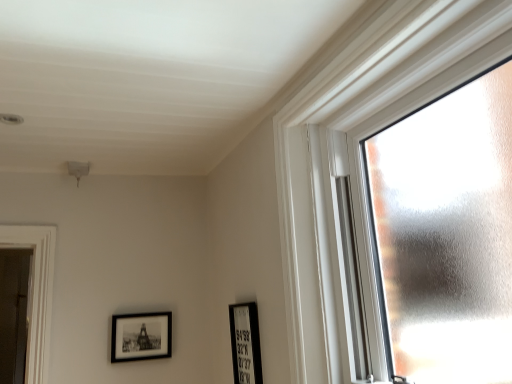
The width and height of the screenshot is (512, 384). In order to click on black matte picture frame at lower center, the second picture frame when ordered from back to front in this screenshot , I will do `click(245, 343)`.

Where is `frosted glass window at right`? frosted glass window at right is located at coordinates (368, 134).

Where is `black matte picture frame at lower center, the 1th picture frame in the right-to-left sequence`? black matte picture frame at lower center, the 1th picture frame in the right-to-left sequence is located at coordinates (245, 343).

Find the location of `window to the right of black matte picture frame at lower left, which ranks as the 2th picture frame in right-to-left order`. window to the right of black matte picture frame at lower left, which ranks as the 2th picture frame in right-to-left order is located at coordinates (368, 134).

What's the angular difference between frosted glass window at right and black matte picture frame at lower left, which appears as the 2th picture frame when viewed from the front,'s facing directions?

The facing directions of frosted glass window at right and black matte picture frame at lower left, which appears as the 2th picture frame when viewed from the front, are 88.3 degrees apart.

Is frosted glass window at right at the left side of black matte picture frame at lower left, acting as the 1th picture frame starting from the back?

No, frosted glass window at right is not to the left of black matte picture frame at lower left, acting as the 1th picture frame starting from the back.

Does point (240, 379) lie behind point (146, 324)?

No, it is in front of (146, 324).

Identify the location of picture frame below the black matte picture frame at lower center, which ranks as the second picture frame in left-to-right order (from the image's perspective). This screenshot has height=384, width=512. (141, 336).

Is black matte picture frame at lower center, placed as the 1th picture frame when sorted from front to back, positioned beyond the bounds of black matte picture frame at lower left, acting as the 1th picture frame starting from the back?

Absolutely, black matte picture frame at lower center, placed as the 1th picture frame when sorted from front to back, is external to black matte picture frame at lower left, acting as the 1th picture frame starting from the back.

Between black matte picture frame at lower center, the 1th picture frame in the right-to-left sequence, and black matte picture frame at lower left, which ranks as the 2th picture frame in right-to-left order, which one has larger width?

With larger width is black matte picture frame at lower center, the 1th picture frame in the right-to-left sequence.

Is black matte picture frame at lower left, which ranks as the 2th picture frame in right-to-left order, situated inside black matte picture frame at lower center, placed as the 1th picture frame when sorted from front to back, or outside?

black matte picture frame at lower left, which ranks as the 2th picture frame in right-to-left order, exists outside the volume of black matte picture frame at lower center, placed as the 1th picture frame when sorted from front to back.

Is black matte picture frame at lower left, marked as the 1th picture frame in a left-to-right arrangement, in contact with black matte picture frame at lower center, placed as the 1th picture frame when sorted from front to back?

black matte picture frame at lower left, marked as the 1th picture frame in a left-to-right arrangement, and black matte picture frame at lower center, placed as the 1th picture frame when sorted from front to back, are clearly separated.

From the image's perspective, is black matte picture frame at lower left, marked as the 1th picture frame in a left-to-right arrangement, located beneath black matte picture frame at lower center, the second picture frame when ordered from back to front?

Yes, from the image's perspective, black matte picture frame at lower left, marked as the 1th picture frame in a left-to-right arrangement, is beneath black matte picture frame at lower center, the second picture frame when ordered from back to front.

From a real-world perspective, is black matte picture frame at lower left, which ranks as the 2th picture frame in right-to-left order, below black matte picture frame at lower center, placed as the 1th picture frame when sorted from front to back?

No, from a real-world perspective, black matte picture frame at lower left, which ranks as the 2th picture frame in right-to-left order, is not below black matte picture frame at lower center, placed as the 1th picture frame when sorted from front to back.

Which is in front, point (357, 224) or point (244, 371)?

Point (357, 224)

Is there a large distance between frosted glass window at right and black matte picture frame at lower center, the 1th picture frame in the right-to-left sequence?

frosted glass window at right is actually quite close to black matte picture frame at lower center, the 1th picture frame in the right-to-left sequence.

Would you say frosted glass window at right is outside black matte picture frame at lower center, placed as the 1th picture frame when sorted from front to back?

frosted glass window at right is positioned outside black matte picture frame at lower center, placed as the 1th picture frame when sorted from front to back.

Locate an element on the screen. The image size is (512, 384). the 1st picture frame to the left when counting from the frosted glass window at right is located at coordinates (245, 343).

Who is more distant, black matte picture frame at lower left, acting as the 1th picture frame starting from the back, or frosted glass window at right?

black matte picture frame at lower left, acting as the 1th picture frame starting from the back, is more distant.

How many degrees apart are the facing directions of black matte picture frame at lower left, acting as the 1th picture frame starting from the back, and frosted glass window at right?

The angle between the facing direction of black matte picture frame at lower left, acting as the 1th picture frame starting from the back, and the facing direction of frosted glass window at right is 88.3 degrees.

From a real-world perspective, which object rests below the other?

black matte picture frame at lower left, which appears as the 2th picture frame when viewed from the front, from a real-world perspective.

Considering the points (160, 326) and (419, 92), which point is behind, point (160, 326) or point (419, 92)?

Point (160, 326)

From a real-world perspective, is black matte picture frame at lower center, the 1th picture frame in the right-to-left sequence, above or below frosted glass window at right?

black matte picture frame at lower center, the 1th picture frame in the right-to-left sequence, is situated lower than frosted glass window at right in the real world.

You are a GUI agent. You are given a task and a screenshot of the screen. Output one action in this format:
    pyautogui.click(x=<x>, y=<y>)
    Task: Click on the window that is above the black matte picture frame at lower center, which ranks as the second picture frame in left-to-right order (from a real-world perspective)
    
    Given the screenshot: What is the action you would take?
    pyautogui.click(x=368, y=134)

Is black matte picture frame at lower center, the 1th picture frame in the right-to-left sequence, not near frosted glass window at right?

No, black matte picture frame at lower center, the 1th picture frame in the right-to-left sequence, is not far from frosted glass window at right.

From their relative heights in the image, would you say black matte picture frame at lower center, the 1th picture frame in the right-to-left sequence, is taller or shorter than frosted glass window at right?

In the image, black matte picture frame at lower center, the 1th picture frame in the right-to-left sequence, appears to be shorter than frosted glass window at right.

Locate an element on the screen. picture frame that is the 2nd object to the left of the frosted glass window at right, starting at the anchor is located at coordinates (141, 336).

This screenshot has height=384, width=512. Find the location of `picture frame above the black matte picture frame at lower left, which appears as the 2th picture frame when viewed from the front (from the image's perspective)`. picture frame above the black matte picture frame at lower left, which appears as the 2th picture frame when viewed from the front (from the image's perspective) is located at coordinates (245, 343).

When comparing their distances from black matte picture frame at lower center, the second picture frame when ordered from back to front, does frosted glass window at right or black matte picture frame at lower left, acting as the 1th picture frame starting from the back, seem further?

frosted glass window at right is further to black matte picture frame at lower center, the second picture frame when ordered from back to front.

Looking at the image, which one is located closer to black matte picture frame at lower center, which ranks as the second picture frame in left-to-right order, black matte picture frame at lower left, which ranks as the 2th picture frame in right-to-left order, or frosted glass window at right?

A: black matte picture frame at lower left, which ranks as the 2th picture frame in right-to-left order, lies closer to black matte picture frame at lower center, which ranks as the second picture frame in left-to-right order, than the other object.

Considering their positions, is black matte picture frame at lower center, which ranks as the second picture frame in left-to-right order, positioned further to frosted glass window at right than black matte picture frame at lower left, which ranks as the 2th picture frame in right-to-left order?

black matte picture frame at lower left, which ranks as the 2th picture frame in right-to-left order, is further to frosted glass window at right.

Consider the image. Estimate the real-world distances between objects in this image. Which object is further from black matte picture frame at lower left, which appears as the 2th picture frame when viewed from the front, frosted glass window at right or black matte picture frame at lower center, the second picture frame when ordered from back to front?

frosted glass window at right.

Which object lies further to the anchor point frosted glass window at right, black matte picture frame at lower left, marked as the 1th picture frame in a left-to-right arrangement, or black matte picture frame at lower center, the 1th picture frame in the right-to-left sequence?

The object further to frosted glass window at right is black matte picture frame at lower left, marked as the 1th picture frame in a left-to-right arrangement.

Which object lies further to the anchor point black matte picture frame at lower left, marked as the 1th picture frame in a left-to-right arrangement, black matte picture frame at lower center, the second picture frame when ordered from back to front, or frosted glass window at right?

frosted glass window at right is positioned further to the anchor black matte picture frame at lower left, marked as the 1th picture frame in a left-to-right arrangement.

Locate an element on the screen. This screenshot has height=384, width=512. picture frame located between frosted glass window at right and black matte picture frame at lower left, which ranks as the 2th picture frame in right-to-left order, in the depth direction is located at coordinates (245, 343).